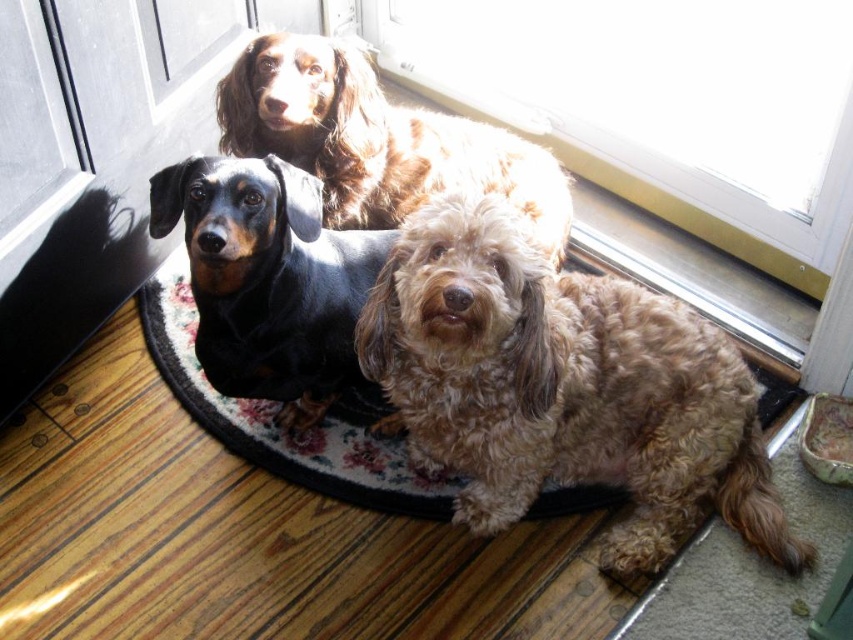
Question: Does fuzzy brown dog at center appear on the right side of shiny brown fur at upper center?

Choices:
 (A) yes
 (B) no

Answer: (A)

Question: Estimate the real-world distances between objects in this image. Which object is closer to the fluffy carpet at center?

Choices:
 (A) shiny brown fur at upper center
 (B) black shiny dachshund at center

Answer: (B)

Question: Is fuzzy brown dog at center closer to the viewer compared to black shiny dachshund at center?

Choices:
 (A) no
 (B) yes

Answer: (B)

Question: Can you confirm if fuzzy brown dog at center is positioned to the right of fluffy carpet at center?

Choices:
 (A) yes
 (B) no

Answer: (A)

Question: Which of the following is the closest to the observer?

Choices:
 (A) fluffy carpet at center
 (B) fuzzy brown dog at center
 (C) shiny brown fur at upper center

Answer: (B)

Question: Which object is positioned farthest from the fuzzy brown dog at center?

Choices:
 (A) shiny brown fur at upper center
 (B) black shiny dachshund at center
 (C) fluffy carpet at center

Answer: (A)